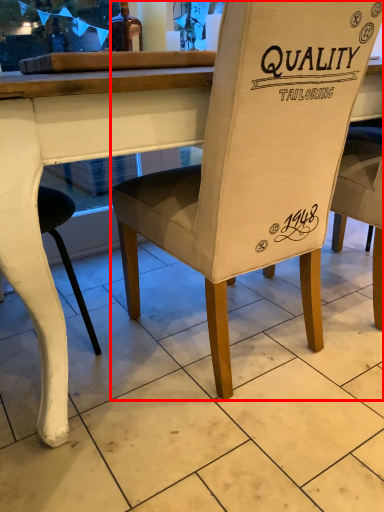
Question: From the image's perspective, what is the correct spatial relationship of chair (annotated by the red box) in relation to bottle?

Choices:
 (A) below
 (B) above

Answer: (A)